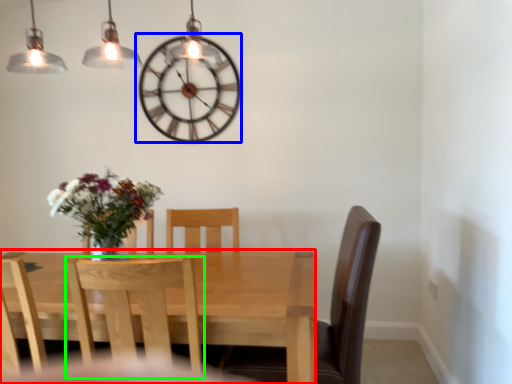
Question: Considering the real-world distances, which object is closest to kitchen & dining room table (highlighted by a red box)? wall clock (highlighted by a blue box) or chair (highlighted by a green box).

Choices:
 (A) wall clock
 (B) chair

Answer: (B)